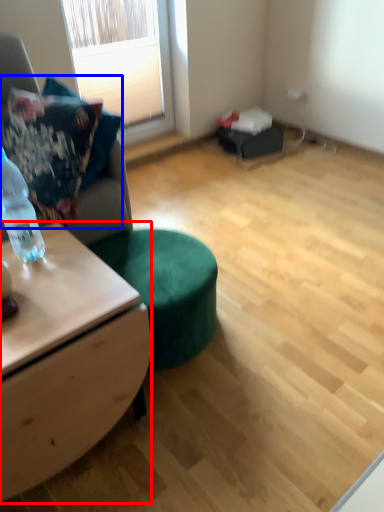
Question: Which object appears closest to the camera in this image, desk (highlighted by a red box) or pillow (highlighted by a blue box)?

Choices:
 (A) desk
 (B) pillow

Answer: (A)